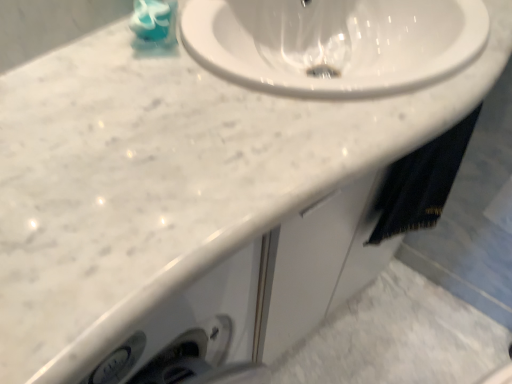
Question: Is teal glossy soap at upper left completely or partially inside black fabric towel at lower right?

Choices:
 (A) no
 (B) yes

Answer: (A)

Question: Considering the relative sizes of black fabric towel at lower right and teal glossy soap at upper left in the image provided, is black fabric towel at lower right taller than teal glossy soap at upper left?

Choices:
 (A) yes
 (B) no

Answer: (A)

Question: Considering the relative sizes of black fabric towel at lower right and teal glossy soap at upper left in the image provided, is black fabric towel at lower right smaller than teal glossy soap at upper left?

Choices:
 (A) no
 (B) yes

Answer: (A)

Question: Can we say black fabric towel at lower right lies outside teal glossy soap at upper left?

Choices:
 (A) no
 (B) yes

Answer: (B)

Question: Is black fabric towel at lower right at the right side of teal glossy soap at upper left?

Choices:
 (A) yes
 (B) no

Answer: (A)

Question: Does black fabric towel at lower right have a greater width compared to teal glossy soap at upper left?

Choices:
 (A) yes
 (B) no

Answer: (B)

Question: Could you tell me if teal glossy soap at upper left is facing black fabric towel at lower right?

Choices:
 (A) yes
 (B) no

Answer: (B)

Question: Is black fabric towel at lower right located within teal glossy soap at upper left?

Choices:
 (A) no
 (B) yes

Answer: (A)

Question: Does teal glossy soap at upper left have a smaller size compared to black fabric towel at lower right?

Choices:
 (A) yes
 (B) no

Answer: (A)

Question: From a real-world perspective, is teal glossy soap at upper left on top of black fabric towel at lower right?

Choices:
 (A) yes
 (B) no

Answer: (A)

Question: Is black fabric towel at lower right at the back of teal glossy soap at upper left?

Choices:
 (A) yes
 (B) no

Answer: (B)

Question: Would you say teal glossy soap at upper left is a long distance from black fabric towel at lower right?

Choices:
 (A) no
 (B) yes

Answer: (A)

Question: From a real-world perspective, is teal glossy soap at upper left positioned above or below black fabric towel at lower right?

Choices:
 (A) below
 (B) above

Answer: (B)